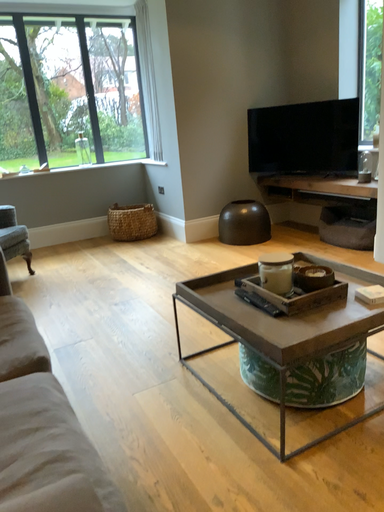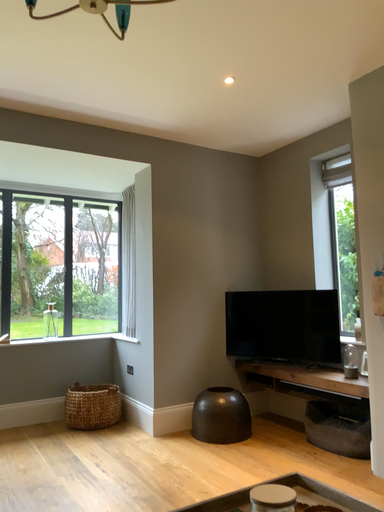
Question: Which way did the camera rotate in the video?

Choices:
 (A) rotated upward
 (B) rotated downward

Answer: (A)